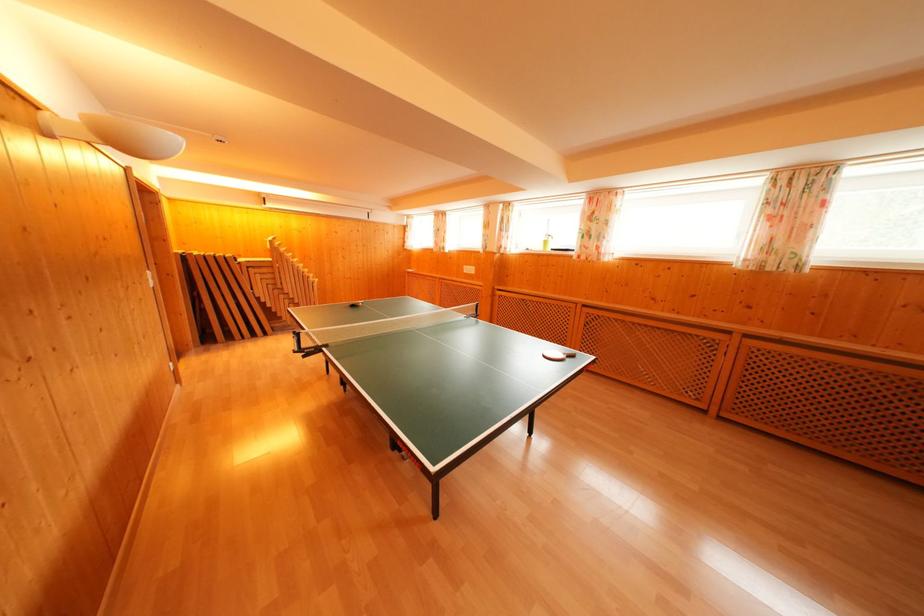
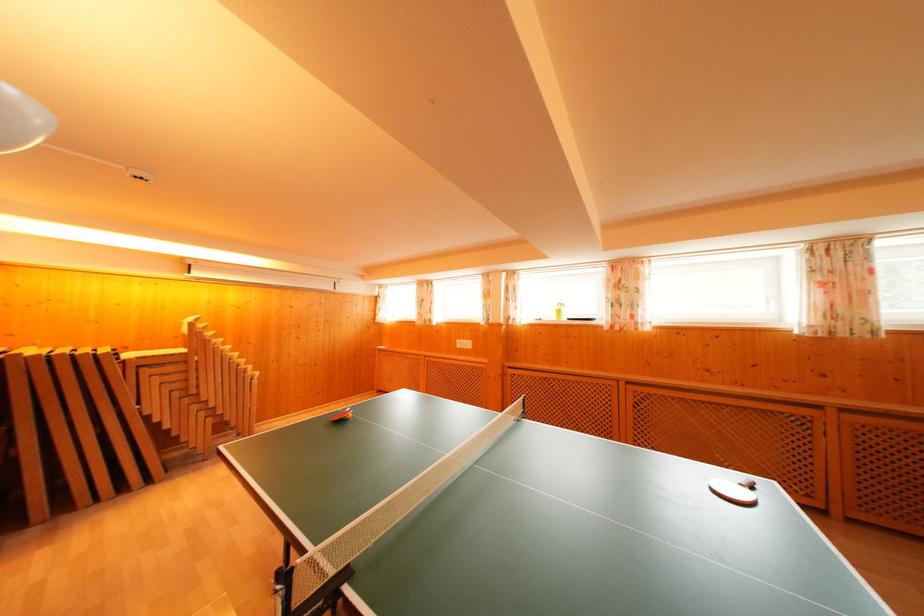
What movement of the cameraman would produce the second image?

The movement direction of the cameraman is left, forward.